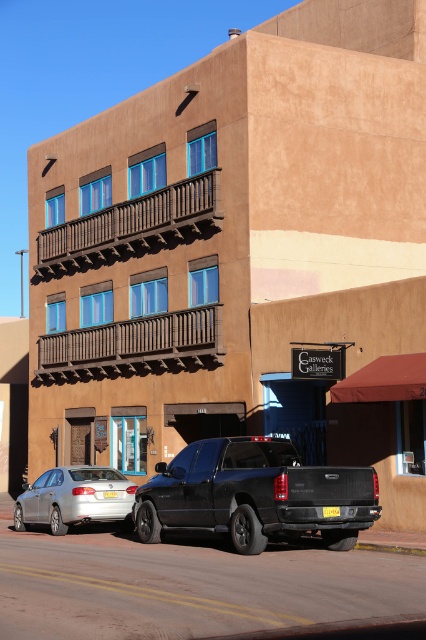
Question: Estimate the real-world distances between objects in this image. Which object is closer to the yellow plastic license plate at center?

Choices:
 (A) silver metallic sedan at lower left
 (B) yellow matte license plate at center

Answer: (A)

Question: Among these objects, which one is farthest from the camera?

Choices:
 (A) yellow plastic license plate at center
 (B) yellow matte license plate at center
 (C) black matte truck at lower center

Answer: (A)

Question: Which object is the closest to the yellow plastic license plate at center?

Choices:
 (A) silver metallic sedan at lower left
 (B) yellow matte license plate at center

Answer: (A)

Question: Where is silver metallic sedan at lower left located in relation to yellow plastic license plate at center in the image?

Choices:
 (A) right
 (B) left

Answer: (A)

Question: Considering the relative positions of silver metallic sedan at lower left and yellow plastic license plate at center in the image provided, where is silver metallic sedan at lower left located with respect to yellow plastic license plate at center?

Choices:
 (A) left
 (B) right

Answer: (B)

Question: Is silver metallic sedan at lower left bigger than yellow plastic license plate at center?

Choices:
 (A) no
 (B) yes

Answer: (B)